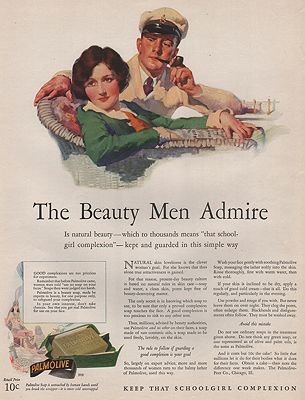
Image resolution: width=305 pixels, height=400 pixels. In order to click on 1 bar soap in this screenshot , I will do `click(76, 341)`.